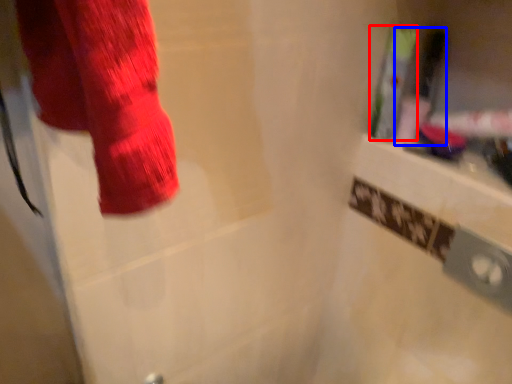
Question: Which of the following is the closest to the observer, toiletry (highlighted by a red box) or toiletry (highlighted by a blue box)?

Choices:
 (A) toiletry
 (B) toiletry

Answer: (A)